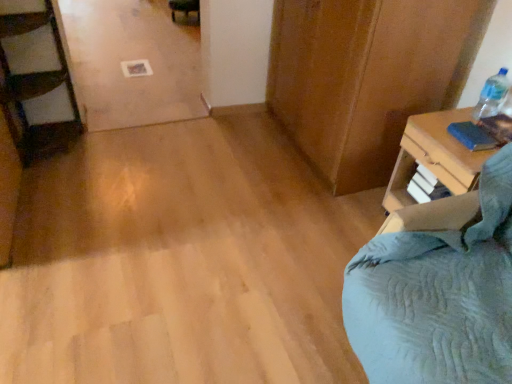
Question: Based on their sizes in the image, would you say blue matte book at upper right is bigger or smaller than clear plastic bottle at upper right?

Choices:
 (A) small
 (B) big

Answer: (A)

Question: Which is correct: blue matte book at upper right is inside clear plastic bottle at upper right, or outside of it?

Choices:
 (A) outside
 (B) inside

Answer: (A)

Question: Based on their relative distances, which object is farther from the blue matte book at upper right?

Choices:
 (A) blue fabric at right
 (B) clear plastic bottle at upper right

Answer: (B)

Question: Which object is the farthest from the blue fabric at right?

Choices:
 (A) clear plastic bottle at upper right
 (B) blue matte book at upper right

Answer: (A)